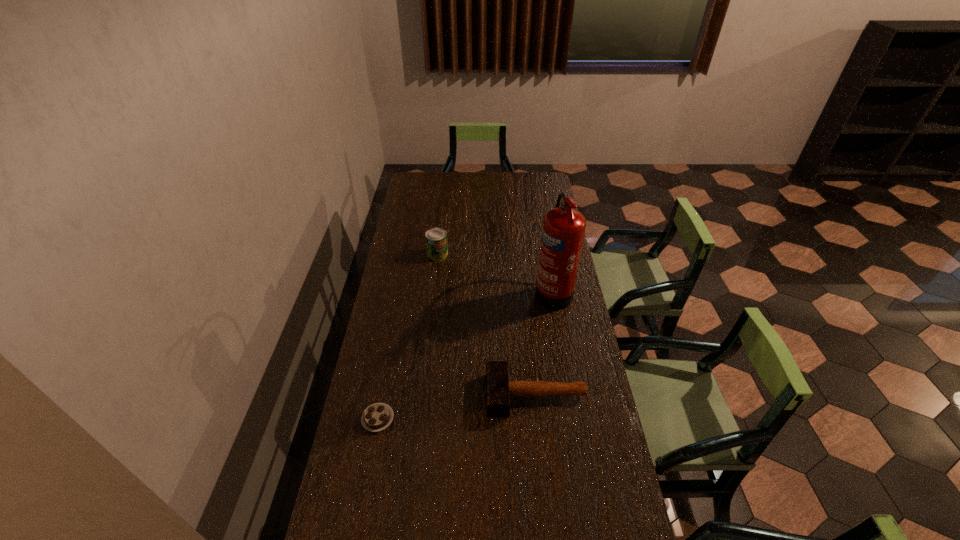
I want to click on the third nearest object, so click(563, 229).

I want to click on the tallest object, so point(563,229).

What are the coordinates of `the farthest object` in the screenshot? It's located at (436, 238).

This screenshot has height=540, width=960. What are the coordinates of `the second tallest object` in the screenshot? It's located at (436, 238).

Where is `the second shortest object`? The height and width of the screenshot is (540, 960). the second shortest object is located at coordinates point(499,389).

Where is `the leftmost object`? the leftmost object is located at coordinates (378, 416).

Where is `the shortest object`? The height and width of the screenshot is (540, 960). the shortest object is located at coordinates (378, 416).

Where is `free space located 0.060m on the surface of the fire extinguisher`? free space located 0.060m on the surface of the fire extinguisher is located at coordinates [520, 291].

Identify the location of vacant point located 0.070m on the surface of the fire extinguisher. (517, 291).

Where is `vacant space located 0.310m on the surface of the fire extinguisher`? The width and height of the screenshot is (960, 540). vacant space located 0.310m on the surface of the fire extinguisher is located at coordinates (461, 291).